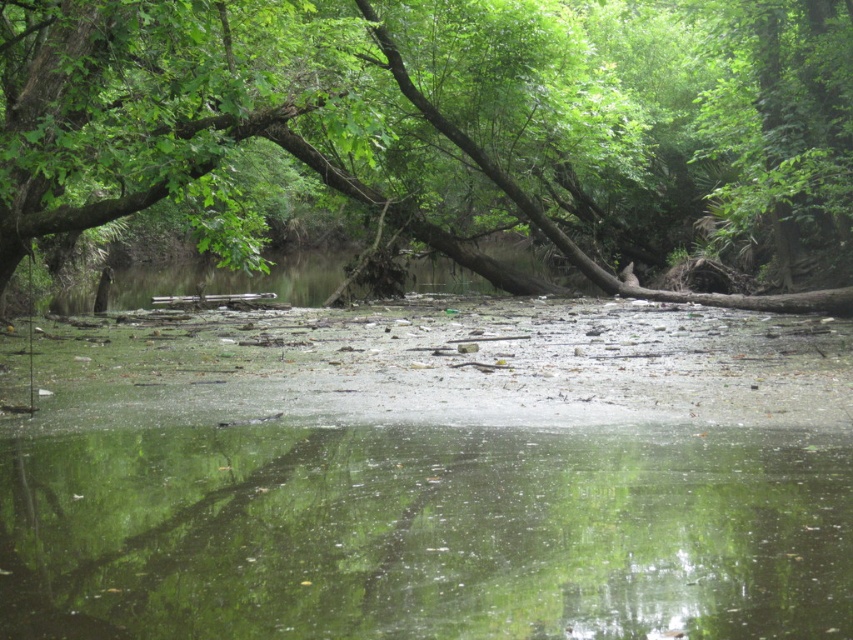
You are standing at the camera position and want to walk towards the green leafy tree at center. If your walking speed is 3 feet per second, how many seconds will it take you to reach the tree?

The distance between you and the green leafy tree at center is 29.28 feet. At a walking speed of 3 feet per second, it would take 29.28 divided by 3, which equals approximately 9.76 seconds to reach the tree.

You are a photographer standing at the edge of the pond. You want to capture a photo where both the green leafy tree at center and the transparent water at center are clearly visible. Which object should you focus on first to ensure both are in focus?

You should focus on the green leafy tree at center first because it is closer to you than the transparent water at center. By focusing on the closer object, the farther one may still be in the depth of field, ensuring both are relatively clear.